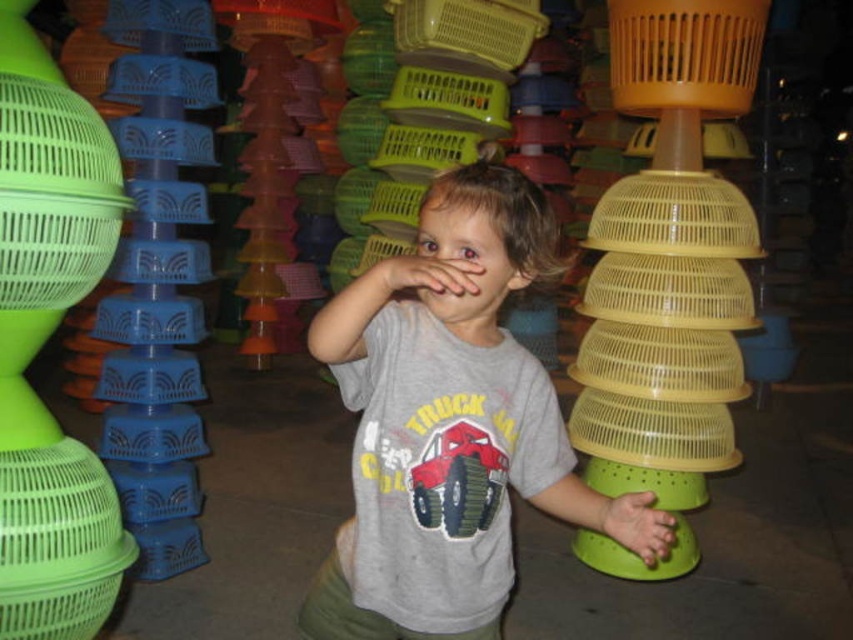
Which is below, yellow translucent basket at center or matte skin hand at center?

matte skin hand at center is lower down.

Which is above, yellow translucent basket at center or matte skin hand at center?

yellow translucent basket at center is above.

Which is behind, point (460, 51) or point (386, 285)?

Point (460, 51)

Find the location of a particular element. The width and height of the screenshot is (853, 640). yellow translucent basket at center is located at coordinates (469, 28).

From the picture: Is yellow translucent basket at center shorter than green matte hand at lower right?

No, yellow translucent basket at center is not shorter than green matte hand at lower right.

Find the location of a particular element. This screenshot has width=853, height=640. yellow translucent basket at center is located at coordinates (469, 28).

Which is behind, point (444, 35) or point (646, 541)?

Point (444, 35)

Locate an element on the screen. yellow translucent basket at center is located at coordinates (469, 28).

Can you confirm if matte yellow plastic colander at center is positioned to the right of yellow plastic basket at center?

No, matte yellow plastic colander at center is not to the right of yellow plastic basket at center.

At what (x,y) coordinates should I click in order to perform the action: click on matte yellow plastic colander at center. Please return your answer as a coordinate pair (x, y). This screenshot has height=640, width=853. Looking at the image, I should click on (669, 256).